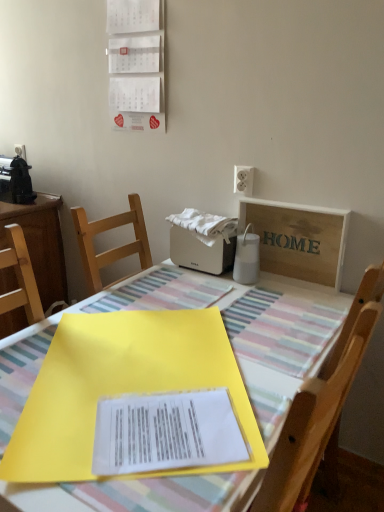
The image size is (384, 512). I want to click on blank space above yellow plastic folder at center (from a real-world perspective), so 167,333.